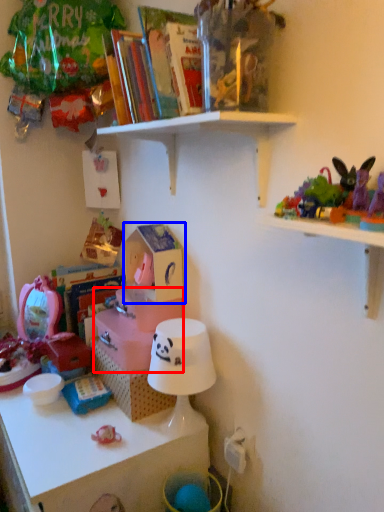
Question: Which object appears farthest to the camera in this image, storage box (highlighted by a red box) or storage box (highlighted by a blue box)?

Choices:
 (A) storage box
 (B) storage box

Answer: (A)